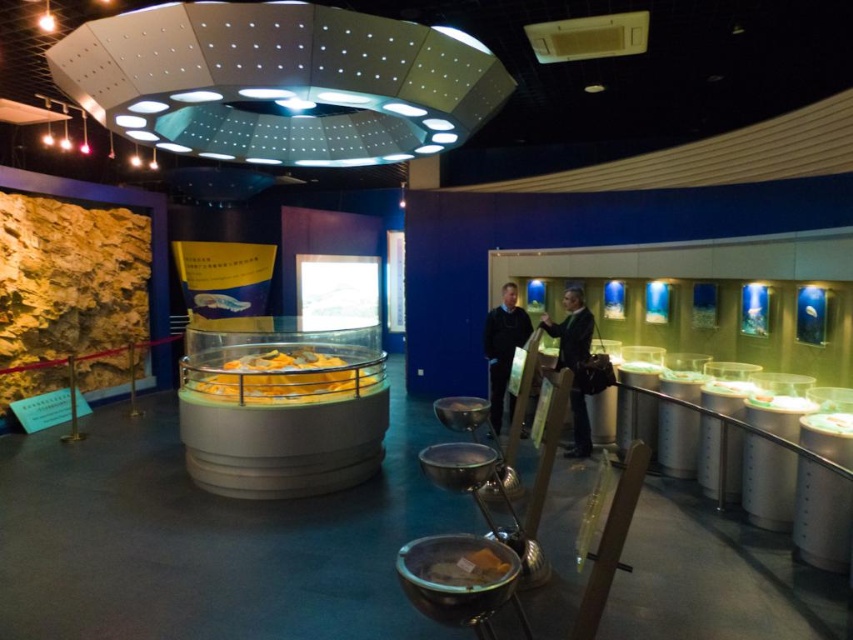
Does black leather jacket at center appear on the left side of dark blue sweater at center?

In fact, black leather jacket at center is to the right of dark blue sweater at center.

Which is above, black leather jacket at center or dark blue sweater at center?

black leather jacket at center

Describe the element at coordinates (573, 362) in the screenshot. I see `black leather jacket at center` at that location.

Find the location of a particular element. The image size is (853, 640). black leather jacket at center is located at coordinates (573, 362).